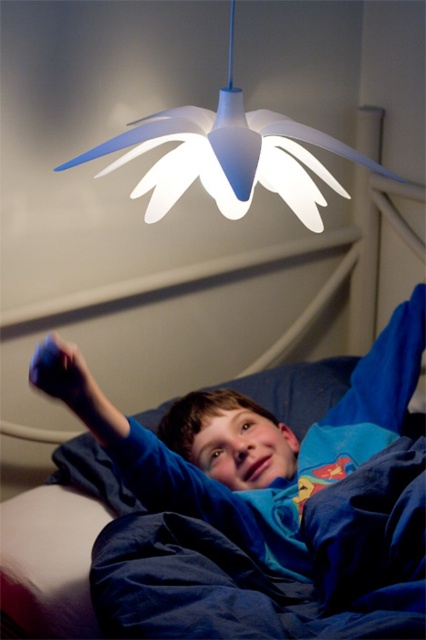
Between white matte/porcelain flower at upper center and blue fabric pillow at lower center, which one is positioned higher?

Positioned higher is white matte/porcelain flower at upper center.

Does white matte/porcelain flower at upper center have a lesser width compared to blue fabric pillow at lower center?

Indeed, white matte/porcelain flower at upper center has a lesser width compared to blue fabric pillow at lower center.

Between point (129, 134) and point (114, 509), which one is positioned in front?

Point (129, 134) is more forward.

Find the location of `white matte/porcelain flower at upper center`. white matte/porcelain flower at upper center is located at coordinates (230, 156).

Which is in front, point (296, 486) or point (262, 138)?

Point (262, 138)

Does blue cotton shirt at lower center have a smaller size compared to white matte/porcelain flower at upper center?

No, blue cotton shirt at lower center is not smaller than white matte/porcelain flower at upper center.

Is point (189, 486) in front of point (189, 141)?

No, (189, 486) is behind (189, 141).

This screenshot has height=640, width=426. In order to click on blue cotton shirt at lower center in this screenshot , I will do `click(276, 476)`.

Which of these two, blue cotton shirt at lower center or blue fabric pillow at lower center, stands shorter?

Standing shorter between the two is blue fabric pillow at lower center.

Is point (417, 365) less distant than point (143, 416)?

Yes, it is in front of point (143, 416).

You are a GUI agent. You are given a task and a screenshot of the screen. Output one action in this format:
    pyautogui.click(x=<x>, y=<y>)
    Task: Click on the blue cotton shirt at lower center
    This screenshot has height=640, width=426.
    Given the screenshot: What is the action you would take?
    pyautogui.click(x=276, y=476)